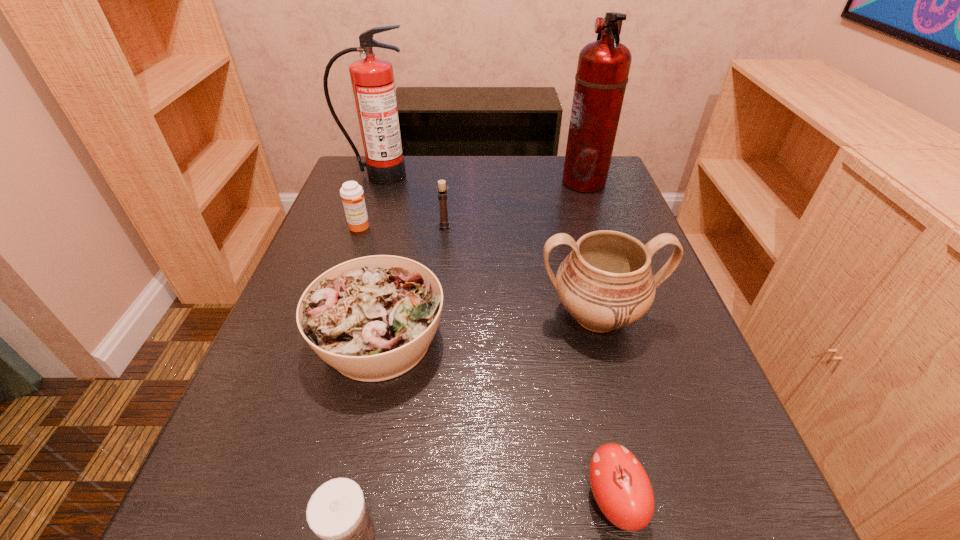
This screenshot has height=540, width=960. Find the location of `vacant area that lies between the sixth shortest object and the left medicine`. vacant area that lies between the sixth shortest object and the left medicine is located at coordinates (478, 271).

You are a GUI agent. You are given a task and a screenshot of the screen. Output one action in this format:
    pyautogui.click(x=<x>, y=<y>)
    Task: Click on the vacant space that is in between the left fire extinguisher and the candle holder
    This screenshot has height=540, width=960.
    Given the screenshot: What is the action you would take?
    pyautogui.click(x=412, y=200)

You are a GUI agent. You are given a task and a screenshot of the screen. Output one action in this format:
    pyautogui.click(x=<x>, y=<y>)
    Task: Click on the object that ranks as the fourth closest to the left fire extinguisher
    The height and width of the screenshot is (540, 960).
    Given the screenshot: What is the action you would take?
    pyautogui.click(x=372, y=318)

Select which object is the fifth closest to the candle holder. Please provide its 2D coordinates. Your answer should be formatted as a tuple, i.e. [(x, y)], where the tuple contains the x and y coordinates of a point satisfying the conditions above.

[(603, 67)]

You are a GUI agent. You are given a task and a screenshot of the screen. Output one action in this format:
    pyautogui.click(x=<x>, y=<y>)
    Task: Click on the free space that satisfies the following two spatial constraints: 1. on the front-facing side of the salad; 2. on the left side of the left fire extinguisher
    
    Given the screenshot: What is the action you would take?
    pyautogui.click(x=324, y=340)

Image resolution: width=960 pixels, height=540 pixels. In order to click on free spot that satisfies the following two spatial constraints: 1. on the front-facing side of the left fire extinguisher; 2. on the right side of the candle holder in this screenshot , I will do `click(362, 225)`.